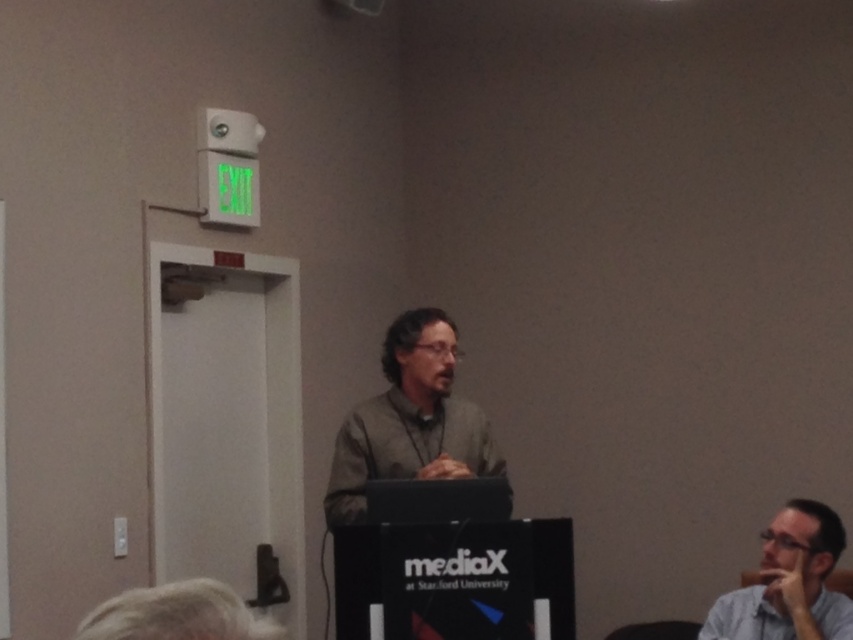
Question: Is matte gray shirt at center positioned in front of light blue shirt at lower right?

Choices:
 (A) yes
 (B) no

Answer: (B)

Question: Is matte gray shirt at center wider than light blue shirt at lower right?

Choices:
 (A) yes
 (B) no

Answer: (A)

Question: Which point is farther to the camera?

Choices:
 (A) (846, 605)
 (B) (408, 353)

Answer: (B)

Question: Does matte gray shirt at center have a larger size compared to light blue shirt at lower right?

Choices:
 (A) no
 (B) yes

Answer: (B)

Question: Which of the following is the farthest from the observer?

Choices:
 (A) matte gray shirt at center
 (B) light blue shirt at lower right

Answer: (A)